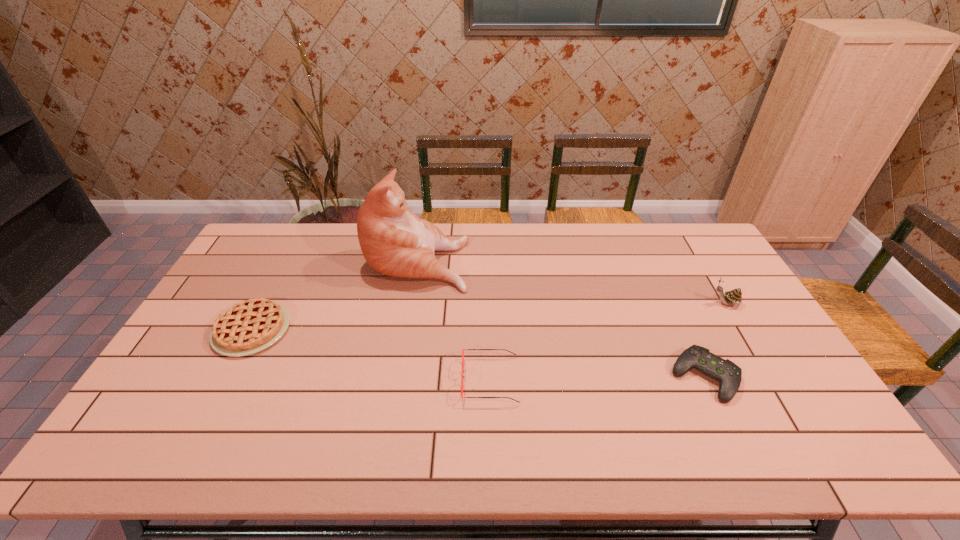
At what (x,y) coordinates should I click in order to perform the action: click on free space between the third shortest object and the cat. Please return your answer as a coordinate pair (x, y). Looking at the image, I should click on (454, 320).

Locate an element on the screen. The image size is (960, 540). free area in between the control and the second tallest object is located at coordinates (715, 340).

Locate an element on the screen. This screenshot has width=960, height=540. vacant point located between the pie and the control is located at coordinates point(478,353).

This screenshot has width=960, height=540. In order to click on free point between the second tallest object and the control in this screenshot , I will do (x=715, y=340).

This screenshot has width=960, height=540. I want to click on object that stands as the third closest to the spectacles, so click(x=250, y=326).

The width and height of the screenshot is (960, 540). I want to click on object that stands as the fourth closest to the control, so click(x=250, y=326).

In order to click on free space that satisfies the following two spatial constraints: 1. on the face of the rightmost object; 2. on the front side of the fourth object from left to right in this screenshot , I will do `click(769, 377)`.

Image resolution: width=960 pixels, height=540 pixels. What are the coordinates of `free spot that satisfies the following two spatial constraints: 1. on the face of the snail; 2. on the front side of the pie` in the screenshot? It's located at (741, 329).